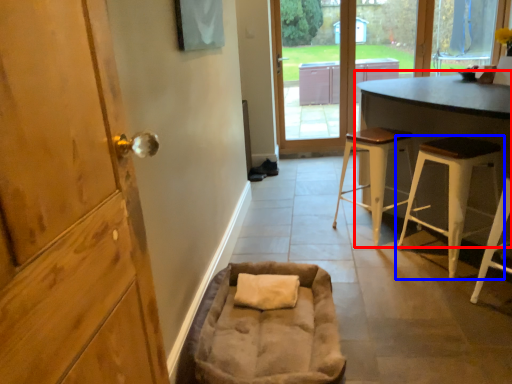
Question: Which object is further to the camera taking this photo, table (highlighted by a red box) or stool (highlighted by a blue box)?

Choices:
 (A) table
 (B) stool

Answer: (B)